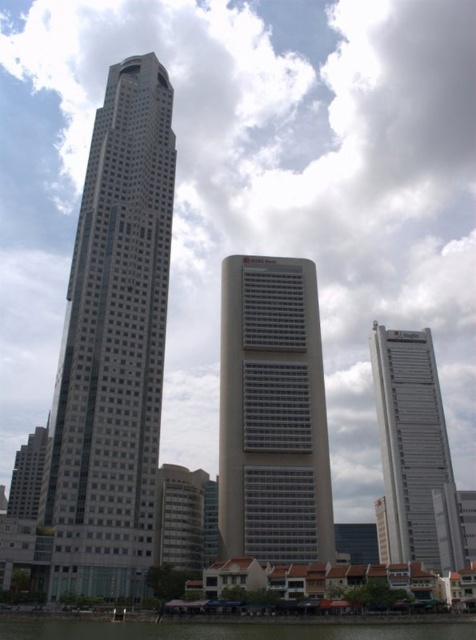
Looking at this image, which is more to the right, gray concrete building at center or white glass tower at right?

white glass tower at right

Can you confirm if gray concrete building at center is bigger than white glass tower at right?

No.

Describe the element at coordinates (273, 412) in the screenshot. I see `gray concrete building at center` at that location.

Where is `gray concrete building at center`? Image resolution: width=476 pixels, height=640 pixels. gray concrete building at center is located at coordinates (273, 412).

Is gray glass skyscraper at left further to camera compared to gray concrete building at center?

No, it is not.

Does gray glass skyscraper at left have a larger size compared to gray concrete building at center?

Indeed, gray glass skyscraper at left has a larger size compared to gray concrete building at center.

The width and height of the screenshot is (476, 640). What do you see at coordinates (113, 346) in the screenshot? I see `gray glass skyscraper at left` at bounding box center [113, 346].

Locate an element on the screen. This screenshot has width=476, height=640. gray glass skyscraper at left is located at coordinates (113, 346).

What do you see at coordinates (409, 440) in the screenshot? I see `white glass tower at right` at bounding box center [409, 440].

Who is shorter, white glass tower at right or green water at lower center?

Standing shorter between the two is green water at lower center.

Is point (395, 493) positioned in front of point (284, 636)?

No.

Where is `white glass tower at right`? This screenshot has height=640, width=476. white glass tower at right is located at coordinates (409, 440).